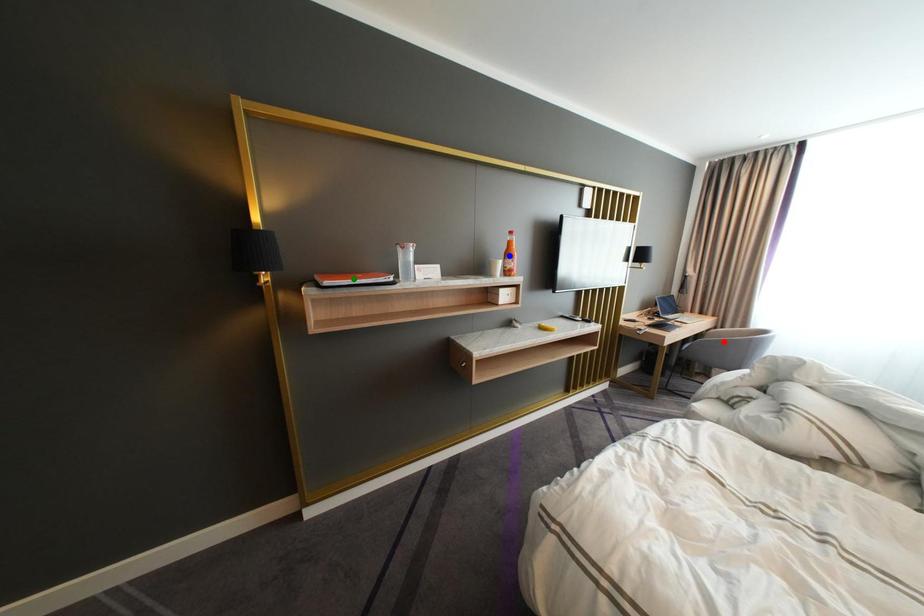
Order these from nearest to farthest:
green point, red point, blue point

1. green point
2. blue point
3. red point